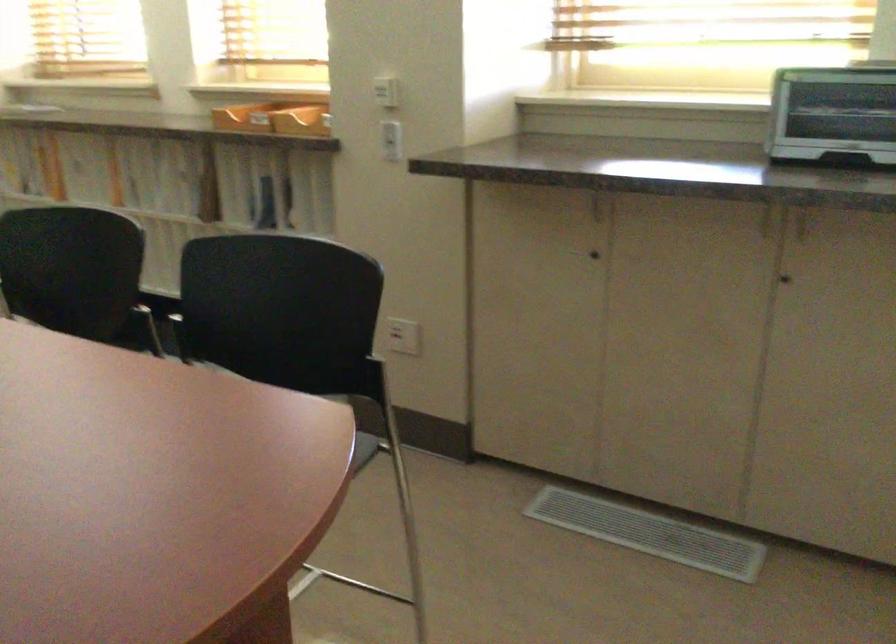
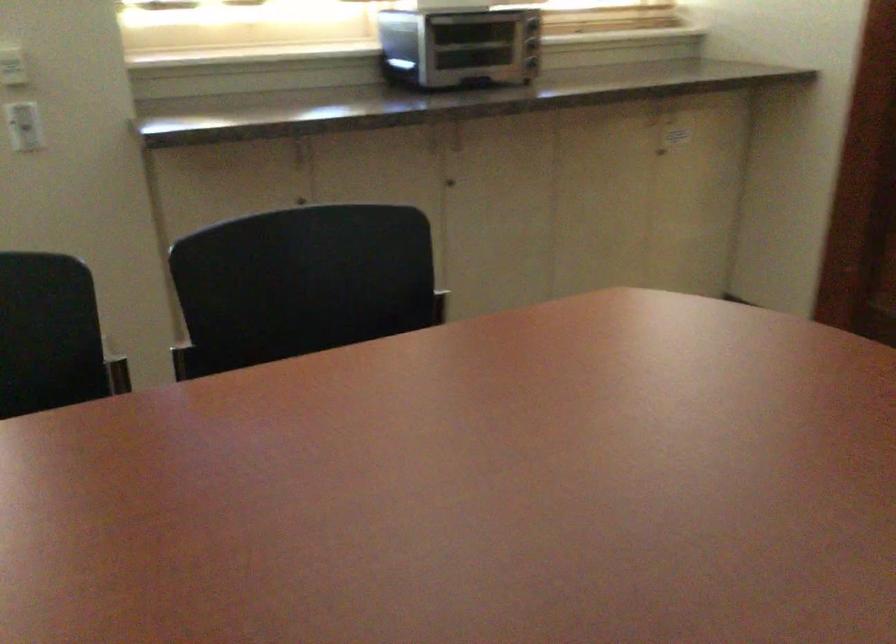
Locate, in the second image, the point that corresponds to point (780, 283) in the first image.

(450, 183)